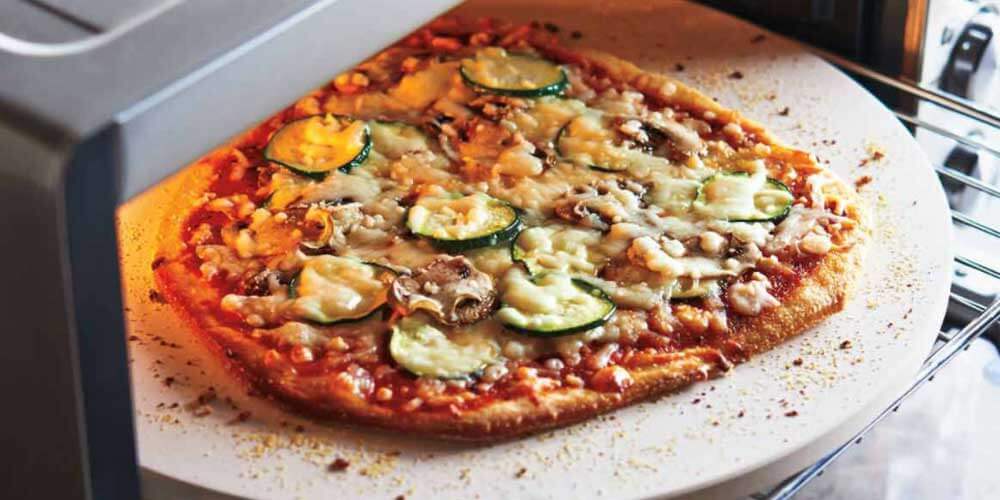
Image resolution: width=1000 pixels, height=500 pixels. What are the coordinates of `crumbs on platter` in the screenshot? It's located at (339, 465).